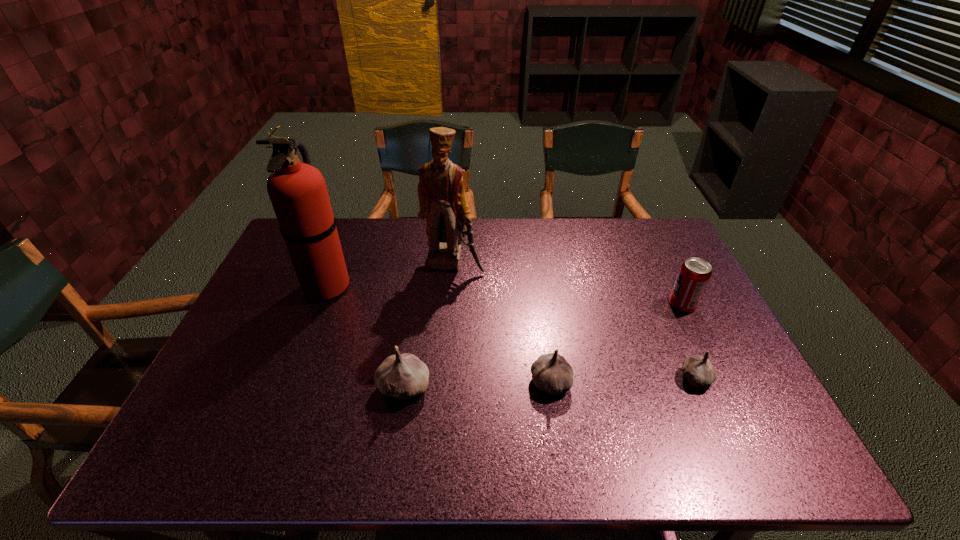
The height and width of the screenshot is (540, 960). Find the location of `vacant space in between the shortest garlic and the second shortest object`. vacant space in between the shortest garlic and the second shortest object is located at coordinates (623, 380).

Image resolution: width=960 pixels, height=540 pixels. I want to click on vacant space in between the second tallest garlic and the rightmost garlic, so click(623, 380).

The image size is (960, 540). What are the coordinates of `object that is the closest to the soda can` in the screenshot? It's located at (699, 371).

Find the location of `object that can be found as the fourth closest to the nutcracker`. object that can be found as the fourth closest to the nutcracker is located at coordinates (694, 274).

Image resolution: width=960 pixels, height=540 pixels. Identify the location of garlic identified as the closest to the soda can. (699, 371).

Identify which garlic is located as the nearest to the fourth object from left to right. Please provide its 2D coordinates. Your answer should be formatted as a tuple, i.e. [(x, y)], where the tuple contains the x and y coordinates of a point satisfying the conditions above.

[(404, 375)]

Find the location of a particular element. vacant region that satisfies the following two spatial constraints: 1. on the front-facing side of the nutcracker; 2. on the left side of the second garlic from left to right is located at coordinates (444, 382).

Locate an element on the screen. The image size is (960, 540). free spot that satisfies the following two spatial constraints: 1. at the nozzle of the fire extinguisher; 2. on the right side of the second shortest garlic is located at coordinates (289, 382).

This screenshot has width=960, height=540. I want to click on vacant area that satisfies the following two spatial constraints: 1. on the back side of the second shortest garlic; 2. on the left side of the soda can, so click(540, 305).

The image size is (960, 540). In order to click on vacant space that satisfies the following two spatial constraints: 1. on the back side of the fourth object from left to right; 2. on the right side of the soda can in this screenshot , I will do `click(540, 305)`.